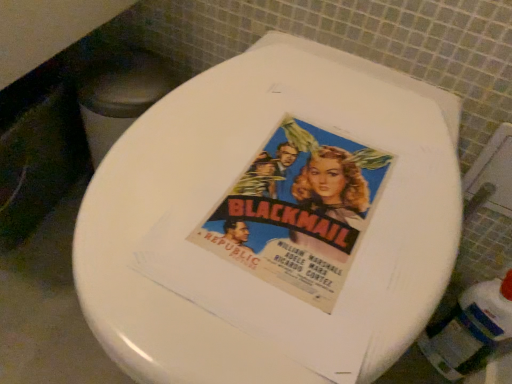
In order to face white plastic bottle at lower right, should I rotate leftwards or rightwards?

You should look right and rotate roughly 27.354 degrees.

Describe the element at coordinates (470, 329) in the screenshot. The image size is (512, 384). I see `white plastic bottle at lower right` at that location.

In order to click on white plastic bottle at lower right in this screenshot , I will do `click(470, 329)`.

What do you see at coordinates (273, 223) in the screenshot?
I see `white glossy toilet seat at center` at bounding box center [273, 223].

I want to click on white glossy toilet seat at center, so click(x=273, y=223).

Locate an element on the screen. This screenshot has width=512, height=384. white plastic bottle at lower right is located at coordinates (470, 329).

Can you confirm if white glossy toilet seat at center is positioned to the left of white plastic bottle at lower right?

Correct, you'll find white glossy toilet seat at center to the left of white plastic bottle at lower right.

Which object is closer to the camera taking this photo, white glossy toilet seat at center or white plastic bottle at lower right?

white glossy toilet seat at center.

Considering the positions of point (262, 289) and point (474, 330), is point (262, 289) closer or farther from the camera than point (474, 330)?

Point (262, 289) is closer to the camera than point (474, 330).

From the image's perspective, between white glossy toilet seat at center and white plastic bottle at lower right, who is located below?

white plastic bottle at lower right.

From a real-world perspective, is white glossy toilet seat at center above or below white plastic bottle at lower right?

Clearly, from a real-world perspective, white glossy toilet seat at center is above white plastic bottle at lower right.

Considering the sizes of objects white glossy toilet seat at center and white plastic bottle at lower right in the image provided, who is thinner, white glossy toilet seat at center or white plastic bottle at lower right?

Thinner between the two is white plastic bottle at lower right.

Does white glossy toilet seat at center have a greater height compared to white plastic bottle at lower right?

Correct, white glossy toilet seat at center is much taller as white plastic bottle at lower right.

Considering the relative sizes of white glossy toilet seat at center and white plastic bottle at lower right in the image provided, is white glossy toilet seat at center smaller than white plastic bottle at lower right?

Incorrect, white glossy toilet seat at center is not smaller in size than white plastic bottle at lower right.

Is white glossy toilet seat at center located outside white plastic bottle at lower right?

white glossy toilet seat at center lies outside white plastic bottle at lower right's area.

Would you consider white glossy toilet seat at center to be distant from white plastic bottle at lower right?

No, white glossy toilet seat at center is not far from white plastic bottle at lower right.

Could you tell me if white glossy toilet seat at center is facing white plastic bottle at lower right?

No, white glossy toilet seat at center is not aimed at white plastic bottle at lower right.

What's the angular difference between white glossy toilet seat at center and white plastic bottle at lower right's facing directions?

The facing directions of white glossy toilet seat at center and white plastic bottle at lower right are 1.06 degrees apart.

You are a GUI agent. You are given a task and a screenshot of the screen. Output one action in this format:
    pyautogui.click(x=<x>, y=<y>)
    Task: Click on the toilet on the left of white plastic bottle at lower right
    The image size is (512, 384).
    Given the screenshot: What is the action you would take?
    pyautogui.click(x=273, y=223)

Which object is positioned more to the right, white plastic bottle at lower right or white glossy toilet seat at center?

white plastic bottle at lower right.

Considering the positions of objects white plastic bottle at lower right and white glossy toilet seat at center in the image provided, who is in front, white plastic bottle at lower right or white glossy toilet seat at center?

white glossy toilet seat at center is in front.

Does point (490, 290) lie behind point (441, 296)?

Yes.

From the image's perspective, is white plastic bottle at lower right on top of white glossy toilet seat at center?

No, from the image's perspective, white plastic bottle at lower right is not over white glossy toilet seat at center.

From a real-world perspective, is white plastic bottle at lower right above or below white glossy toilet seat at center?

In terms of real-world spatial position, white plastic bottle at lower right is below white glossy toilet seat at center.

In the scene shown: Considering the sizes of objects white plastic bottle at lower right and white glossy toilet seat at center in the image provided, who is wider, white plastic bottle at lower right or white glossy toilet seat at center?

Wider between the two is white glossy toilet seat at center.

Considering the sizes of objects white plastic bottle at lower right and white glossy toilet seat at center in the image provided, who is shorter, white plastic bottle at lower right or white glossy toilet seat at center?

white plastic bottle at lower right is shorter.

In the scene shown: Which of these two, white plastic bottle at lower right or white glossy toilet seat at center, is bigger?

With larger size is white glossy toilet seat at center.

Would you say white plastic bottle at lower right is outside white glossy toilet seat at center?

Yes, white plastic bottle at lower right is not within white glossy toilet seat at center.

Is white plastic bottle at lower right far from white glossy toilet seat at center?

They are positioned close to each other.

Is white plastic bottle at lower right facing towards white glossy toilet seat at center?

No, white plastic bottle at lower right is not oriented towards white glossy toilet seat at center.

I want to click on toilet on the left of white plastic bottle at lower right, so click(x=273, y=223).

The height and width of the screenshot is (384, 512). I want to click on toilet in front of the white plastic bottle at lower right, so click(273, 223).

Find the location of a particular element. The width and height of the screenshot is (512, 384). toilet above the white plastic bottle at lower right (from the image's perspective) is located at coordinates (273, 223).